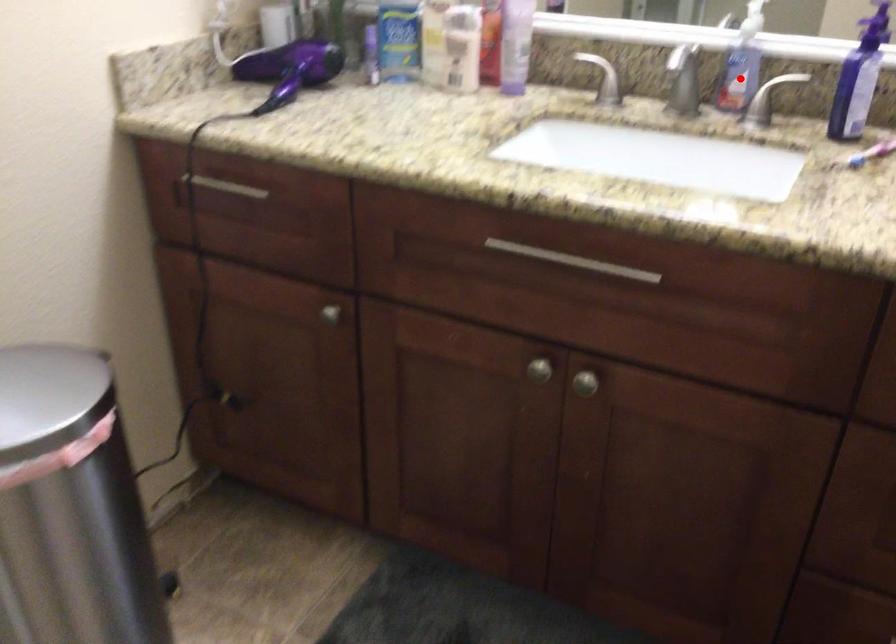
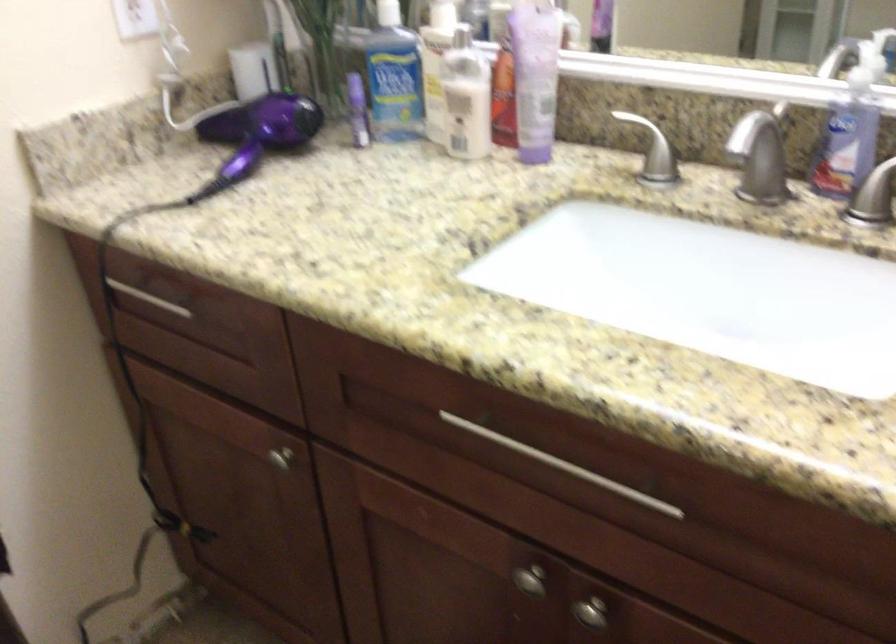
Question: A red point is marked in image1. In image2, is the corresponding 3D point closer to the camera or farther? Reply with the corresponding letter.

Choices:
 (A) The corresponding 3D point is closer.
 (B) The corresponding 3D point is farther.

Answer: (A)